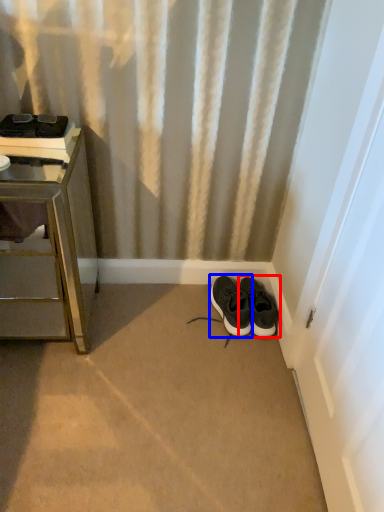
Question: Which object is further to the camera taking this photo, footwear (highlighted by a red box) or footwear (highlighted by a blue box)?

Choices:
 (A) footwear
 (B) footwear

Answer: (A)